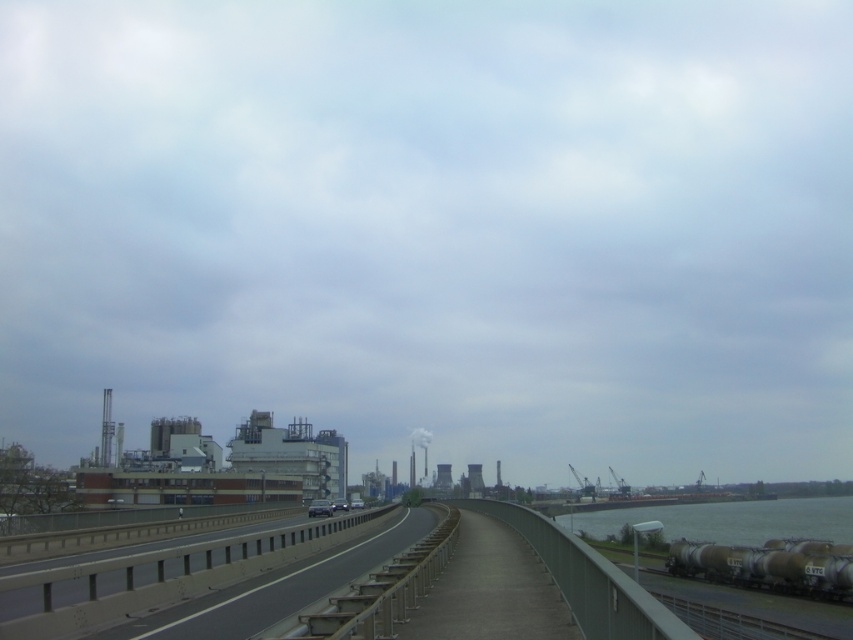
Question: Does gray metallic water at lower right appear on the right side of silver metallic train carriages at lower right?

Choices:
 (A) yes
 (B) no

Answer: (A)

Question: Does gray metallic water at lower right appear over silver metallic train carriages at lower right?

Choices:
 (A) yes
 (B) no

Answer: (B)

Question: Can you confirm if gray metallic water at lower right is positioned to the left of silver metallic train carriages at lower right?

Choices:
 (A) no
 (B) yes

Answer: (A)

Question: Which point appears farthest from the camera in this image?

Choices:
 (A) (828, 566)
 (B) (576, 512)

Answer: (B)